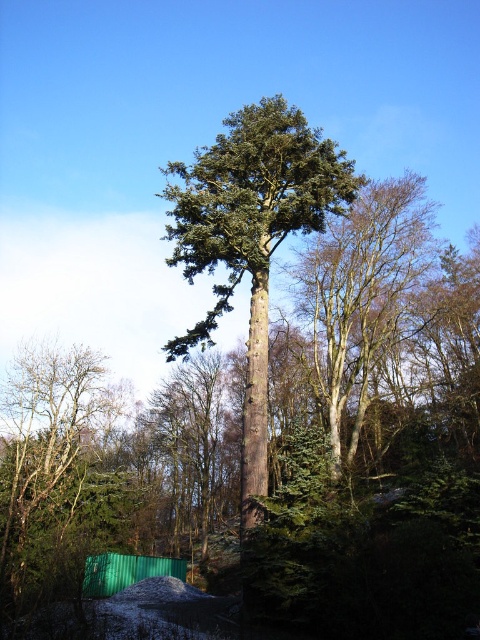
You are standing in a snowy forest and see two trees at the center. Which tree, the green textured tree at center or the green rough bark tree at center, is closer to you?

The green textured tree at center is closer to the viewer than the green rough bark tree at center.

You are planning to plant a new tree in your backyard. You have two options from the image you see. The first is the green textured tree at center, and the second is the green matte tree at lower left. Considering their sizes, which tree would you choose if you want a taller tree for your backyard?

The green textured tree at center is much taller than the green matte tree at lower left, so you should choose the green textured tree at center for a taller tree in your backyard.